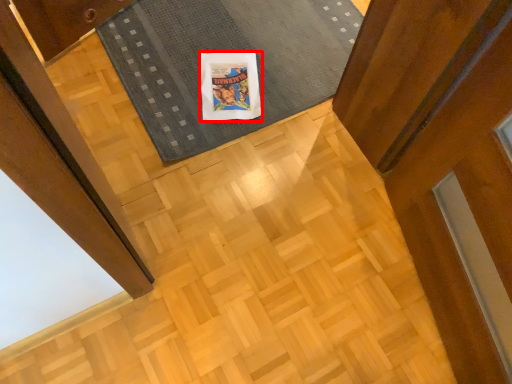
Question: From the image's perspective, what is the correct spatial relationship of comic book character (annotated by the red box) in relation to mat?

Choices:
 (A) above
 (B) below

Answer: (B)